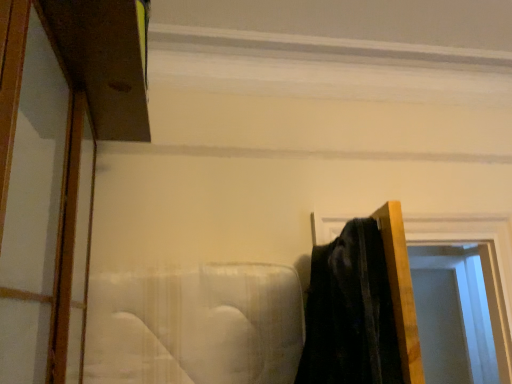
Question: Looking at their shapes, would you say transparent glass door at right is wider or thinner than wooden door frame at right?

Choices:
 (A) wide
 (B) thin

Answer: (B)

Question: From the image's perspective, relative to wooden door frame at right, is transparent glass door at right above or below?

Choices:
 (A) below
 (B) above

Answer: (A)

Question: Would you say transparent glass door at right is to the left or to the right of wooden door frame at right in the picture?

Choices:
 (A) left
 (B) right

Answer: (B)

Question: In the image, is wooden door frame at right on the left side or the right side of transparent glass door at right?

Choices:
 (A) right
 (B) left

Answer: (B)

Question: From a real-world perspective, is wooden door frame at right physically located above or below transparent glass door at right?

Choices:
 (A) above
 (B) below

Answer: (A)

Question: Would you say wooden door frame at right is inside or outside transparent glass door at right?

Choices:
 (A) inside
 (B) outside

Answer: (B)

Question: Is point (446, 215) positioned closer to the camera than point (493, 319)?

Choices:
 (A) closer
 (B) farther

Answer: (A)